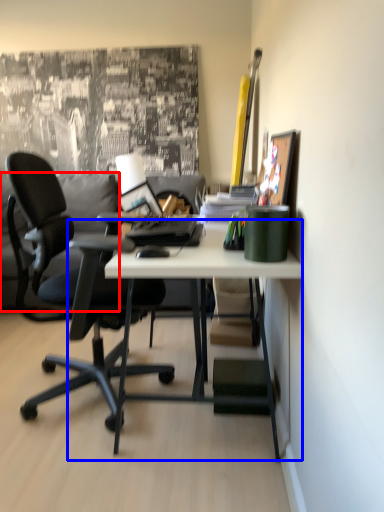
Question: Among these objects, which one is farthest to the camera, pillow (highlighted by a red box) or desk (highlighted by a blue box)?

Choices:
 (A) pillow
 (B) desk

Answer: (A)